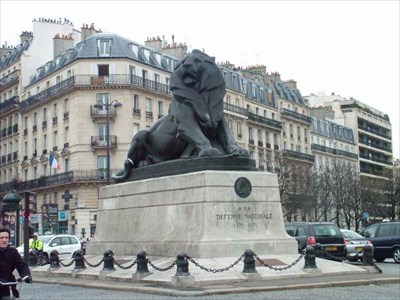
Image resolution: width=400 pixels, height=300 pixels. I want to click on statue, so pyautogui.click(x=189, y=131).